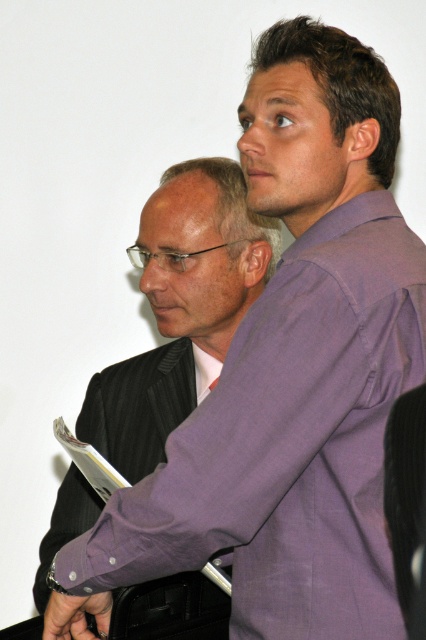
You are a photographer setting up for a group photo. You need to ensure that the purple matte shirt at center and the dark gray pinstripe suit at left are both visible in the frame. Based on their positions and sizes, which object might require more space in the composition?

The purple matte shirt at center might require more space in the composition because it is wider than the dark gray pinstripe suit at left according to the description.

You are a photographer standing 2 meters away from the two people in the image. You want to take a closeup shot of the point at coordinates point (68,499). Can you move closer to the point to get a better shot without exceeding the 1.5 meters distance limit?

The distance of point (68,499) from camera is 1.58 meters. Since you are currently 2 meters away, moving closer to 1.58 meters would still keep you within the 1.5 meters limit. Wait, actually, if the point is already at 1.58 meters, moving closer than that would go beyond the limit. Therefore, you cannot move closer than 1.58 meters, which is already beyond the 1.5 meters limit. Hence, you cannot get closer without exceeding the limit.